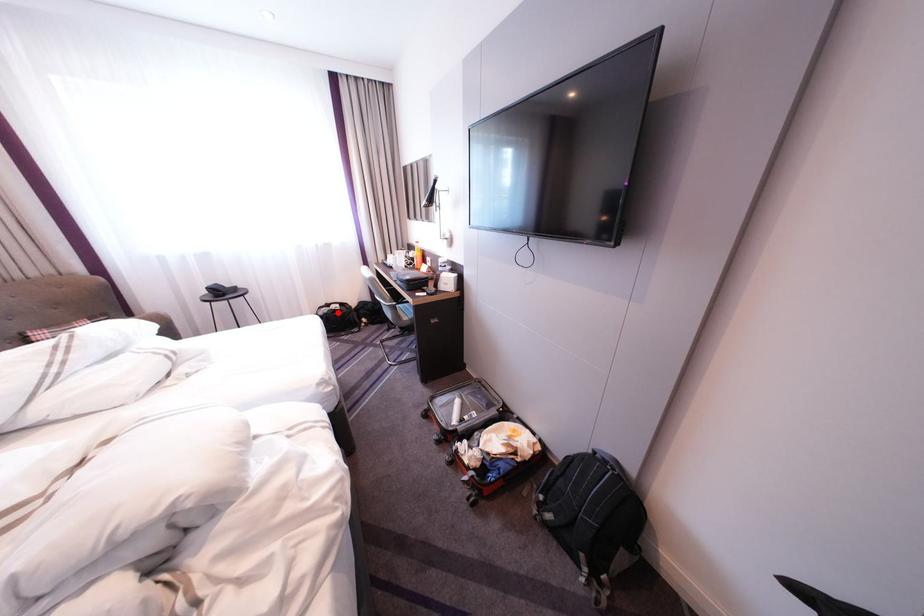
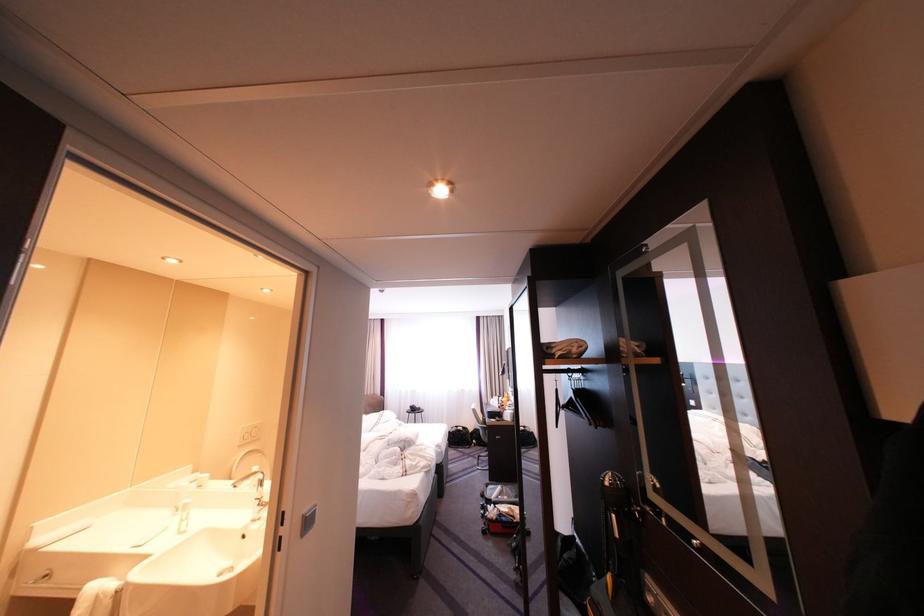
Where in the second image is the point corresponding to the highlighted location from the first image?

(467, 431)